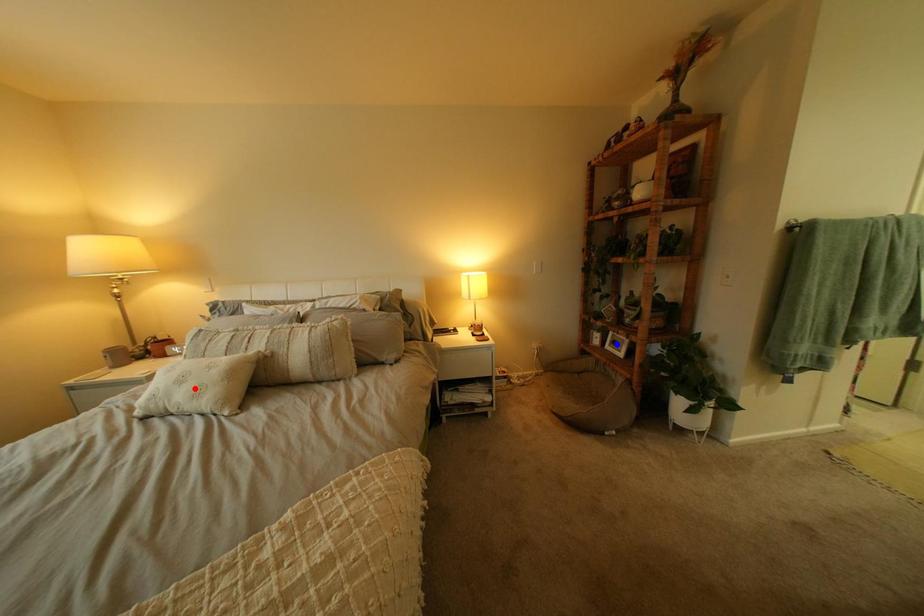
Question: Which of the two points in the image is closer to the camera?

Choices:
 (A) Blue point is closer.
 (B) Red point is closer.

Answer: (B)